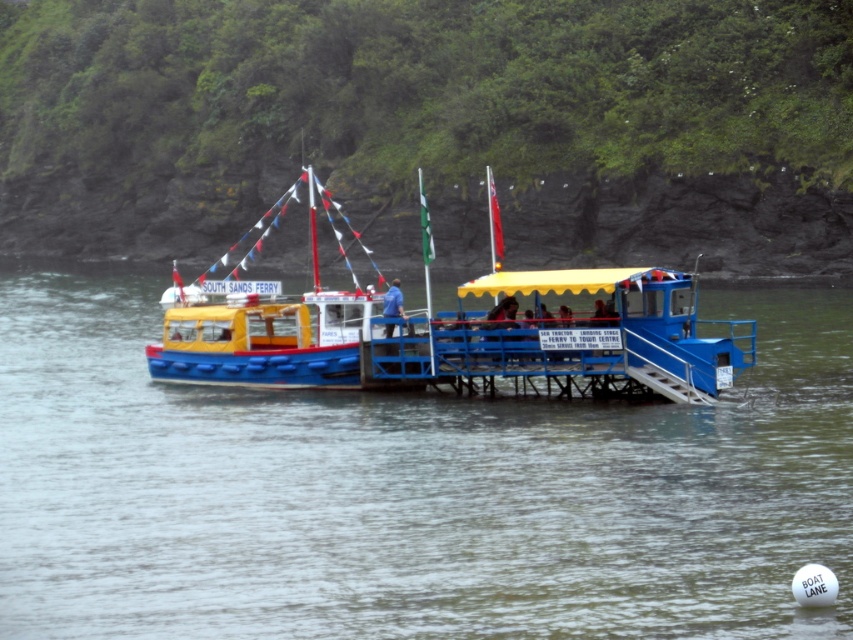
You are a passenger on the yellow matte ferry at center and want to see the transparent water at center. Which object is lower in height between the two?

The transparent water at center has a lesser height compared to the yellow matte ferry at center, so the transparent water at center is lower in height.